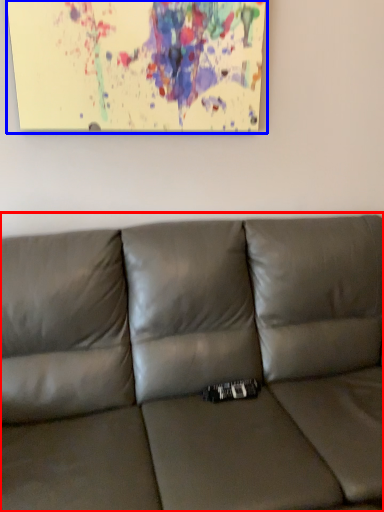
Question: Which of the following is the farthest to the observer, studio couch (highlighted by a red box) or picture frame (highlighted by a blue box)?

Choices:
 (A) studio couch
 (B) picture frame

Answer: (B)